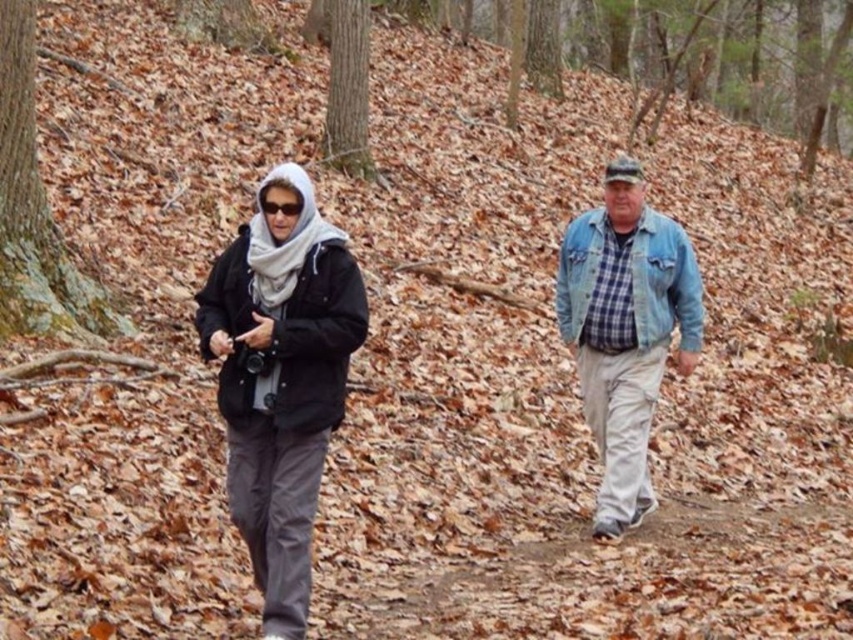
You are a hiker who needs to pass between the black matte jacket at left and the denim jacket at right on the forest trail. The trail is only 8 feet wide. Can you safely navigate through without stepping off the path?

The black matte jacket at left is 9.53 feet away from the denim jacket at right, which exceeds the 8 feet width of the trail. Therefore, you cannot safely navigate between them without stepping off the path.

You are standing at the point marked as point (274, 385) in the forest trail image. What object is located exactly at this point?

The black matte jacket at center is located exactly at point (274, 385).

You are a hiker trying to decide which path to take. You see two people ahead on the trail. The person in the black matte jacket at center and the person in the denim jacket at right are walking on the same trail. Which direction should you follow them if you want to stay on the higher ground?

The black matte jacket at center is below denim jacket at right, so to stay on higher ground, you should follow the direction where the denim jacket at right is located.